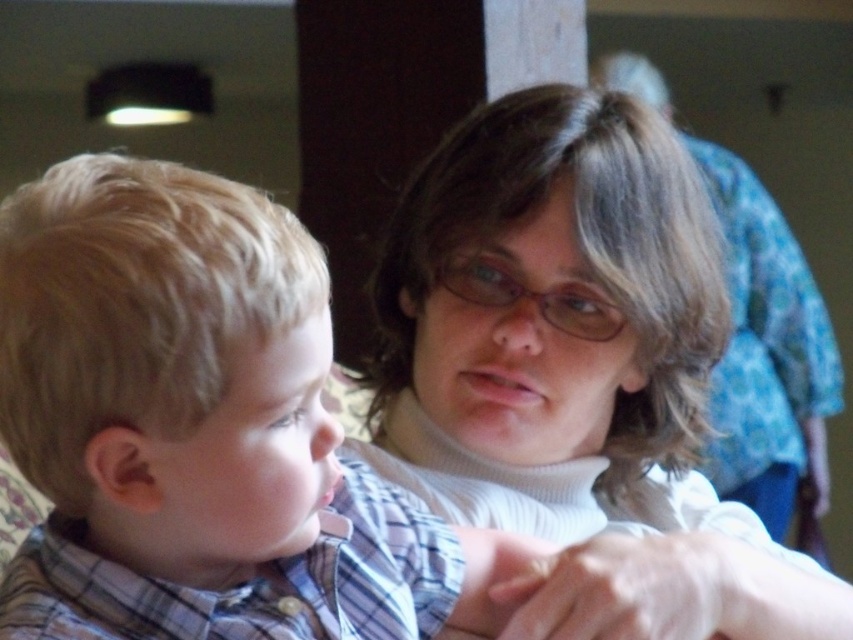
Question: Does plaid shirt at left have a greater width compared to white turtleneck sweater at center?

Choices:
 (A) yes
 (B) no

Answer: (B)

Question: Does plaid shirt at left appear on the left side of white turtleneck sweater at center?

Choices:
 (A) yes
 (B) no

Answer: (A)

Question: Among these objects, which one is farthest from the camera?

Choices:
 (A) plaid shirt at left
 (B) white turtleneck sweater at center

Answer: (B)

Question: Can you confirm if plaid shirt at left is bigger than white turtleneck sweater at center?

Choices:
 (A) no
 (B) yes

Answer: (A)

Question: Which of the following is the farthest from the observer?

Choices:
 (A) plaid shirt at left
 (B) white turtleneck sweater at center

Answer: (B)